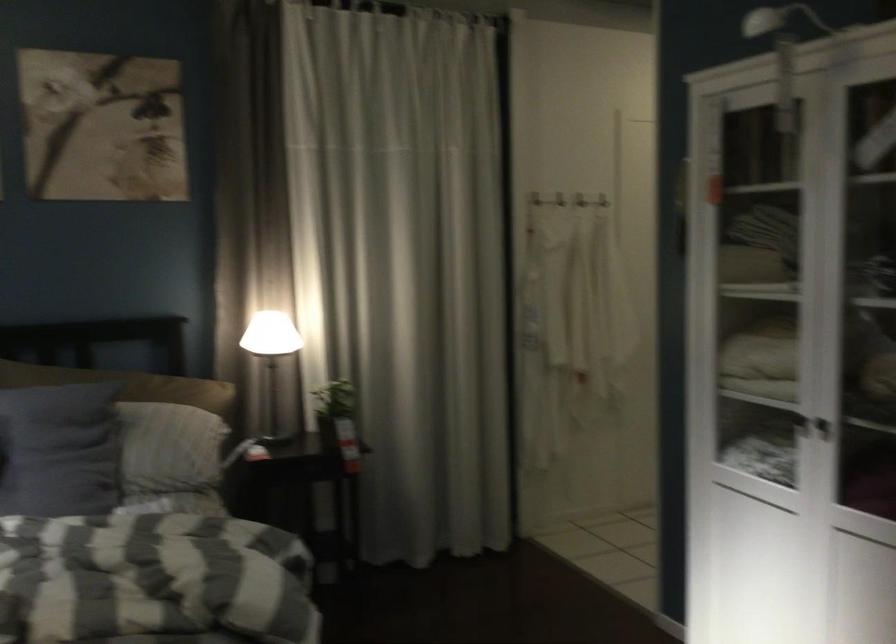
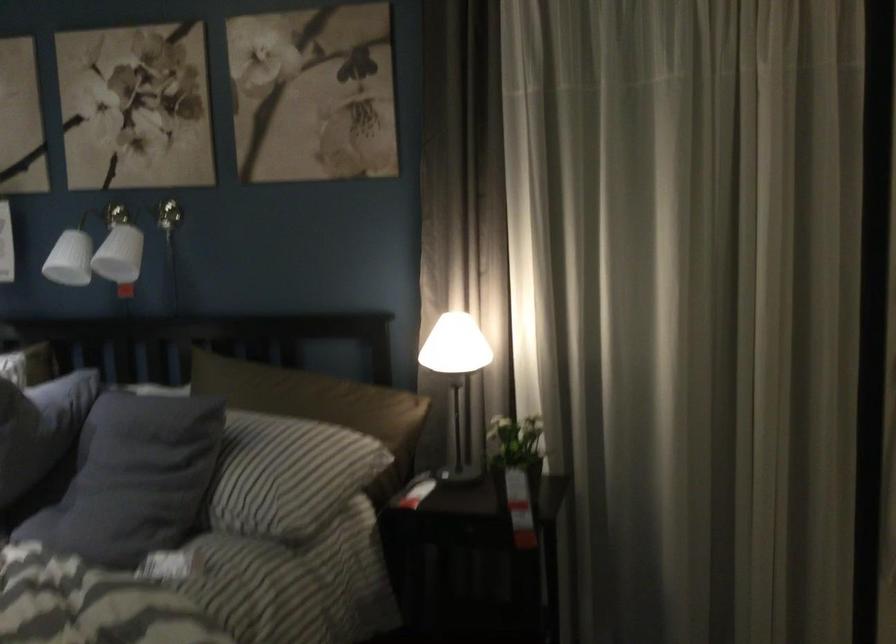
In the second image, find the point that corresponds to point 280,334 in the first image.

(455, 345)